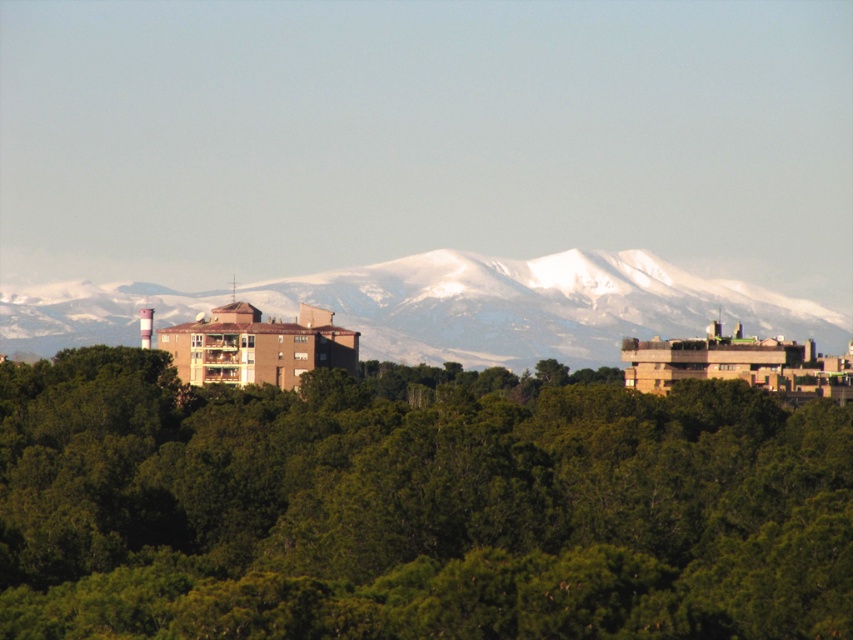
Question: Which of the following is the farthest from the observer?

Choices:
 (A) (457, 352)
 (B) (271, 580)

Answer: (A)

Question: Does green leafy trees at center appear on the right side of snowy white mountain range at upper center?

Choices:
 (A) yes
 (B) no

Answer: (B)

Question: Among these points, which one is nearest to the camera?

Choices:
 (A) (447, 259)
 (B) (535, 428)

Answer: (B)

Question: Can you confirm if green leafy trees at center is positioned below snowy white mountain range at upper center?

Choices:
 (A) no
 (B) yes

Answer: (B)

Question: Which point is closer to the camera?

Choices:
 (A) (567, 260)
 (B) (567, 518)

Answer: (B)

Question: In this image, where is green leafy trees at center located relative to snowy white mountain range at upper center?

Choices:
 (A) right
 (B) left

Answer: (B)